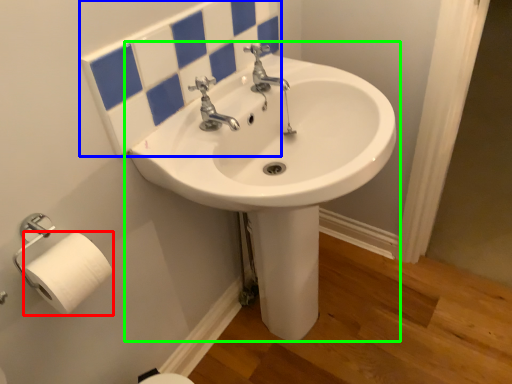
Question: Which is farther away from toilet paper (highlighted by a red box)? mirror (highlighted by a blue box) or sink (highlighted by a green box)?

Choices:
 (A) mirror
 (B) sink

Answer: (B)